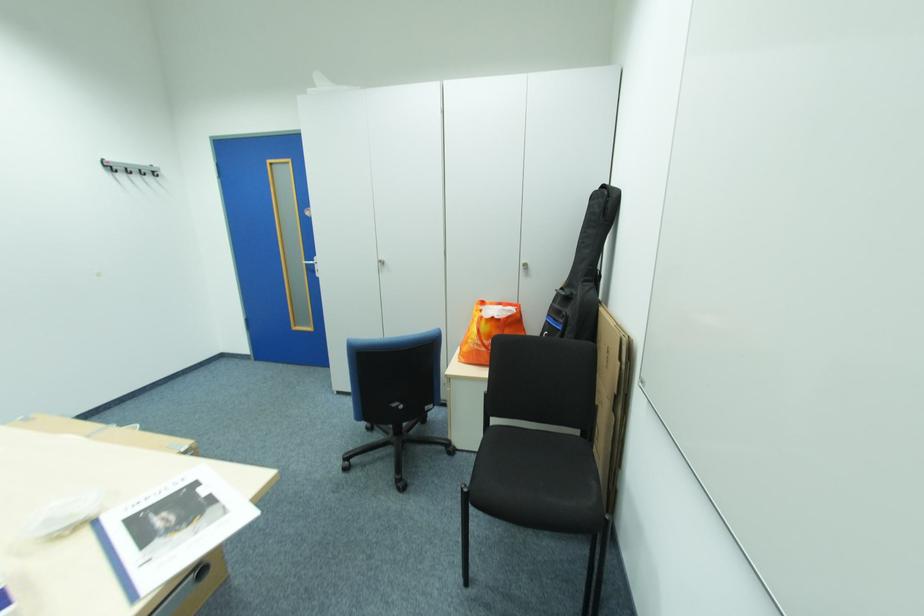
This screenshot has width=924, height=616. Describe the element at coordinates (312, 265) in the screenshot. I see `the silver door handle` at that location.